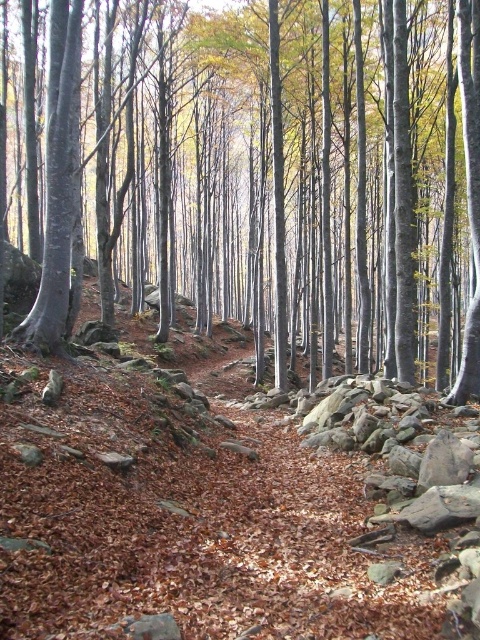
Question: Which point appears farthest from the camera in this image?

Choices:
 (A) (240, 396)
 (B) (328, 365)

Answer: (B)

Question: Does brown wood forest at center have a lesser width compared to brown leafy hillside at center?

Choices:
 (A) yes
 (B) no

Answer: (B)

Question: Which point is farther from the camera taking this photo?

Choices:
 (A) (96, 390)
 (B) (105, 300)

Answer: (B)

Question: Is brown wood forest at center to the left of brown leafy hillside at center from the viewer's perspective?

Choices:
 (A) no
 (B) yes

Answer: (B)

Question: Which point is farther to the camera?

Choices:
 (A) brown leafy hillside at center
 (B) brown wood forest at center

Answer: (B)

Question: Does brown wood forest at center have a smaller size compared to brown leafy hillside at center?

Choices:
 (A) yes
 (B) no

Answer: (B)